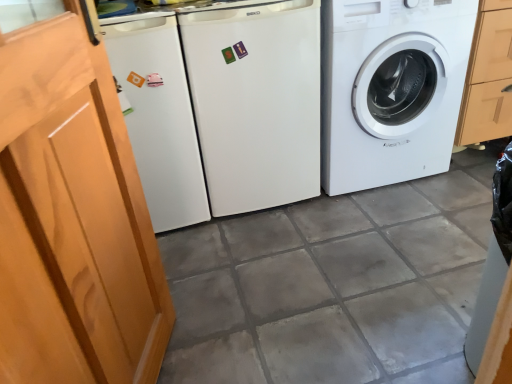
What do you see at coordinates (256, 100) in the screenshot? The image size is (512, 384). I see `white matte refrigerator at center, the second washing machine positioned from the right` at bounding box center [256, 100].

What is the approximate width of white matte refrigerator at center, the second washing machine positioned from the right?

It is 24.18 inches.

What do you see at coordinates (390, 88) in the screenshot? This screenshot has width=512, height=384. I see `white glossy washing machine at right, placed as the 2th washing machine when sorted from left to right` at bounding box center [390, 88].

At what (x,y) coordinates should I click in order to perform the action: click on white matte refrigerator at center, the first washing machine viewed from the left. Please return your answer as a coordinate pair (x, y). Looking at the image, I should click on (256, 100).

From the image's perspective, is wooden screen door at left on white glossy washing machine at right, placed as the 2th washing machine when sorted from left to right?

No.

From a real-world perspective, is wooden screen door at left physically located above or below white glossy washing machine at right, placed as the 2th washing machine when sorted from left to right?

In terms of real-world spatial position, wooden screen door at left is above white glossy washing machine at right, placed as the 2th washing machine when sorted from left to right.

Is wooden screen door at left surrounding white glossy washing machine at right, placed as the 2th washing machine when sorted from left to right?

No, white glossy washing machine at right, placed as the 2th washing machine when sorted from left to right, is not surrounded by wooden screen door at left.

Considering the sizes of wooden screen door at left and white glossy washing machine at right, the first washing machine viewed from the right, in the image, is wooden screen door at left taller or shorter than white glossy washing machine at right, the first washing machine viewed from the right,?

Clearly, wooden screen door at left is taller compared to white glossy washing machine at right, the first washing machine viewed from the right.

Considering the sizes of objects white glossy washing machine at right, the first washing machine viewed from the right, and white matte refrigerator at center, the first washing machine viewed from the left, in the image provided, who is taller, white glossy washing machine at right, the first washing machine viewed from the right, or white matte refrigerator at center, the first washing machine viewed from the left,?

Standing taller between the two is white matte refrigerator at center, the first washing machine viewed from the left.

At what (x,y) coordinates should I click in order to perform the action: click on washing machine below the white matte refrigerator at center, the second washing machine positioned from the right (from a real-world perspective). Please return your answer as a coordinate pair (x, y). Looking at the image, I should click on (390, 88).

Is white glossy washing machine at right, placed as the 2th washing machine when sorted from left to right, to the left of white matte refrigerator at center, the first washing machine viewed from the left, from the viewer's perspective?

Incorrect, white glossy washing machine at right, placed as the 2th washing machine when sorted from left to right, is not on the left side of white matte refrigerator at center, the first washing machine viewed from the left.

Does point (321, 31) come in front of point (257, 92)?

Yes, point (321, 31) is in front of point (257, 92).

Where is `screen door to the left of white matte refrigerator at center, the first washing machine viewed from the left`? screen door to the left of white matte refrigerator at center, the first washing machine viewed from the left is located at coordinates point(73,218).

Is wooden screen door at left positioned behind white matte refrigerator at center, the second washing machine positioned from the right?

No, the depth of wooden screen door at left is less than that of white matte refrigerator at center, the second washing machine positioned from the right.

Between point (101, 127) and point (210, 64), which one is positioned behind?

The point (210, 64) is farther.

Considering the positions of objects wooden screen door at left and white matte refrigerator at center, the second washing machine positioned from the right, in the image provided, who is more to the left, wooden screen door at left or white matte refrigerator at center, the second washing machine positioned from the right,?

wooden screen door at left.

Between white glossy washing machine at right, the first washing machine viewed from the right, and wooden screen door at left, which one is positioned in front?

wooden screen door at left is in front.

Is point (468, 38) more distant than point (22, 247)?

Yes, it is.

How distant is white glossy washing machine at right, placed as the 2th washing machine when sorted from left to right, from wooden screen door at left?

white glossy washing machine at right, placed as the 2th washing machine when sorted from left to right, is 1.10 meters from wooden screen door at left.

Considering the sizes of white matte refrigerator at center, the first washing machine viewed from the left, and wooden screen door at left in the image, is white matte refrigerator at center, the first washing machine viewed from the left, taller or shorter than wooden screen door at left?

white matte refrigerator at center, the first washing machine viewed from the left, is shorter than wooden screen door at left.

Would you consider white matte refrigerator at center, the second washing machine positioned from the right, to be distant from wooden screen door at left?

No.

From a real-world perspective, between white matte refrigerator at center, the first washing machine viewed from the left, and wooden screen door at left, who is vertically higher?

From a 3D spatial view, wooden screen door at left is above.

Can you tell me how much white matte refrigerator at center, the second washing machine positioned from the right, and wooden screen door at left differ in facing direction?

white matte refrigerator at center, the second washing machine positioned from the right, and wooden screen door at left are facing 0.00021 degrees away from each other.

Could you measure the distance between white matte refrigerator at center, the second washing machine positioned from the right, and white glossy washing machine at right, placed as the 2th washing machine when sorted from left to right?

The distance of white matte refrigerator at center, the second washing machine positioned from the right, from white glossy washing machine at right, placed as the 2th washing machine when sorted from left to right, is 12.49 inches.

Can you confirm if white matte refrigerator at center, the first washing machine viewed from the left, is taller than white glossy washing machine at right, the first washing machine viewed from the right?

Yes.

From the image's perspective, which is below, white matte refrigerator at center, the second washing machine positioned from the right, or white glossy washing machine at right, the first washing machine viewed from the right?

From the image's view, white matte refrigerator at center, the second washing machine positioned from the right, is below.

Is white matte refrigerator at center, the first washing machine viewed from the left, touching white glossy washing machine at right, placed as the 2th washing machine when sorted from left to right?

white matte refrigerator at center, the first washing machine viewed from the left, is not next to white glossy washing machine at right, placed as the 2th washing machine when sorted from left to right, and they're not touching.

What are the coordinates of `screen door that appears in front of the white glossy washing machine at right, placed as the 2th washing machine when sorted from left to right` in the screenshot? It's located at (73, 218).

This screenshot has height=384, width=512. Identify the location of washing machine that appears above the white matte refrigerator at center, the second washing machine positioned from the right (from the image's perspective). (390, 88).

Which object lies further to the anchor point wooden screen door at left, white matte refrigerator at center, the second washing machine positioned from the right, or white glossy washing machine at right, placed as the 2th washing machine when sorted from left to right?

The object further to wooden screen door at left is white glossy washing machine at right, placed as the 2th washing machine when sorted from left to right.

Looking at the image, which one is located closer to white glossy washing machine at right, the first washing machine viewed from the right, wooden screen door at left or white matte refrigerator at center, the first washing machine viewed from the left?

white matte refrigerator at center, the first washing machine viewed from the left, lies closer to white glossy washing machine at right, the first washing machine viewed from the right, than the other object.

From the image, which object appears to be nearer to white matte refrigerator at center, the second washing machine positioned from the right, white glossy washing machine at right, placed as the 2th washing machine when sorted from left to right, or wooden screen door at left?

Based on the image, white glossy washing machine at right, placed as the 2th washing machine when sorted from left to right, appears to be nearer to white matte refrigerator at center, the second washing machine positioned from the right.

Looking at the image, which one is located closer to wooden screen door at left, white glossy washing machine at right, placed as the 2th washing machine when sorted from left to right, or white matte refrigerator at center, the first washing machine viewed from the left?

white matte refrigerator at center, the first washing machine viewed from the left, lies closer to wooden screen door at left than the other object.

Which object lies further to the anchor point white matte refrigerator at center, the second washing machine positioned from the right, wooden screen door at left or white glossy washing machine at right, placed as the 2th washing machine when sorted from left to right?

wooden screen door at left lies further to white matte refrigerator at center, the second washing machine positioned from the right, than the other object.

Looking at the image, which one is located closer to white glossy washing machine at right, the first washing machine viewed from the right, white matte refrigerator at center, the second washing machine positioned from the right, or wooden screen door at left?

white matte refrigerator at center, the second washing machine positioned from the right, is closer to white glossy washing machine at right, the first washing machine viewed from the right.

Identify the location of washing machine between wooden screen door at left and white glossy washing machine at right, the first washing machine viewed from the right. (256, 100).